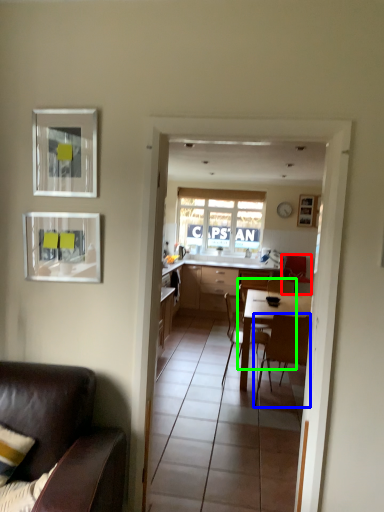
Question: Based on their relative distances, which object is nearer to chair (highlighted by a red box)? Choose from chair (highlighted by a blue box) and chair (highlighted by a green box).

Choices:
 (A) chair
 (B) chair

Answer: (B)